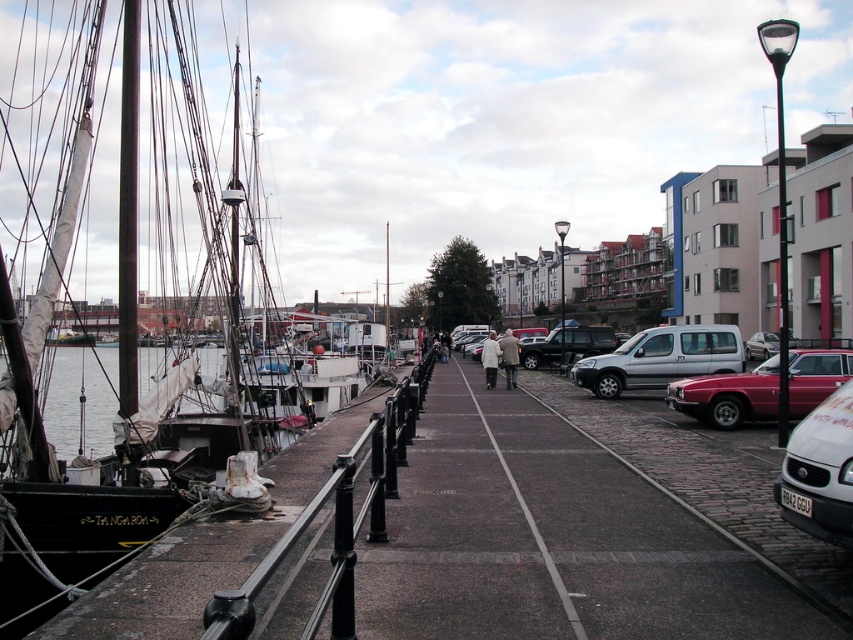
Question: Can you confirm if black matte sailboat at left is positioned to the right of rusty metal mast at left?

Choices:
 (A) yes
 (B) no

Answer: (B)

Question: Does rusty metal mast at left lie behind shiny silver mast at center?

Choices:
 (A) yes
 (B) no

Answer: (B)

Question: Among these points, which one is farthest from the camera?

Choices:
 (A) (473, 493)
 (B) (788, 470)
 (C) (602, 396)
 (D) (293, 400)

Answer: (D)

Question: Is smooth dark wood dock at left thinner than black matte sailboat at left?

Choices:
 (A) no
 (B) yes

Answer: (B)

Question: Among these objects, which one is nearest to the camera?

Choices:
 (A) smooth dark wood dock at left
 (B) silver metallic van at center
 (C) metallic red sedan at right

Answer: (A)

Question: Which point is closer to the camera?

Choices:
 (A) black matte sailboat at left
 (B) shiny silver mast at center
 (C) rusty metal mast at left

Answer: (A)